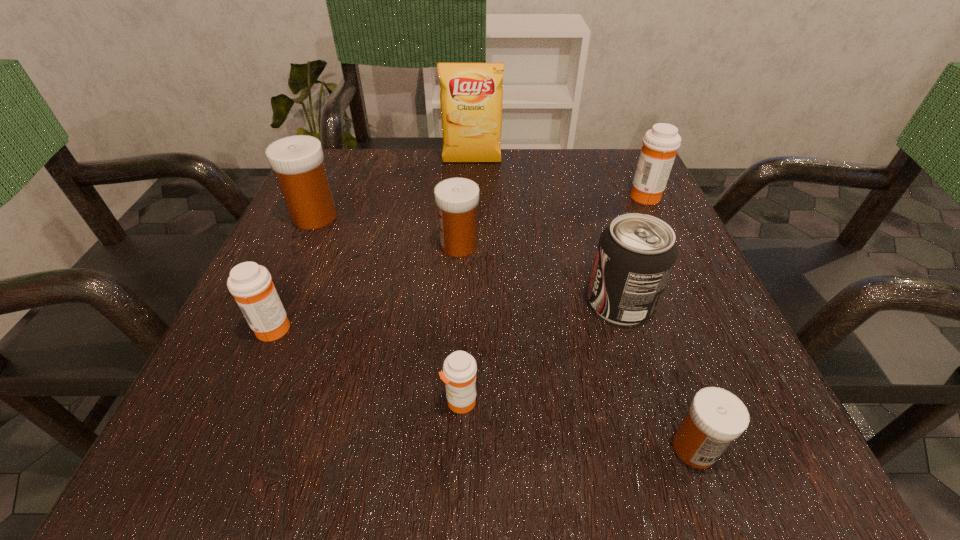
Locate an element on the screen. the fourth farthest object is located at coordinates (457, 199).

I want to click on the second nearest medicine, so click(x=459, y=371).

The image size is (960, 540). What are the coordinates of `the second orange medicine from left to right` in the screenshot? It's located at (459, 371).

This screenshot has height=540, width=960. What are the coordinates of `the fifth medicine from left to right` in the screenshot? It's located at (716, 417).

I want to click on the smallest white medicine, so click(x=716, y=417).

This screenshot has height=540, width=960. Find the location of `vacant space located on the front of the farthest object with the logo`. vacant space located on the front of the farthest object with the logo is located at coordinates (470, 233).

Find the location of a particular element. free spot located on the front of the rightmost object is located at coordinates pyautogui.click(x=718, y=349).

The width and height of the screenshot is (960, 540). In order to click on free location located on the front of the farthest white medicine in this screenshot , I will do `click(259, 341)`.

The height and width of the screenshot is (540, 960). What are the coordinates of `free point located 0.280m on the back of the black soda can` in the screenshot? It's located at pos(585,188).

The image size is (960, 540). In order to click on free location located on the front of the second smallest orange medicine in this screenshot , I will do `click(243, 397)`.